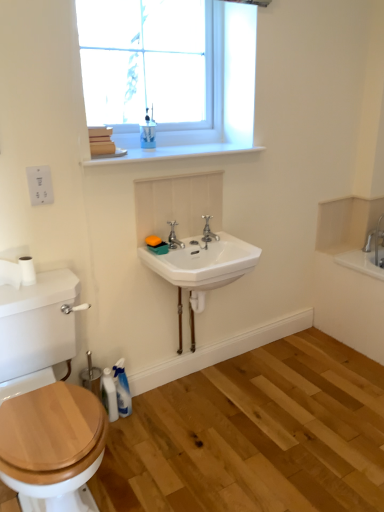
Question: Considering the relative sizes of blue glossy cup at upper center, acting as the 1th toiletry starting from the top, and white matte toilet paper at left in the image provided, is blue glossy cup at upper center, acting as the 1th toiletry starting from the top, smaller than white matte toilet paper at left?

Choices:
 (A) yes
 (B) no

Answer: (B)

Question: Does blue glossy cup at upper center, the 1th toiletry viewed from the right, have a greater height compared to white matte toilet paper at left?

Choices:
 (A) no
 (B) yes

Answer: (B)

Question: From a real-world perspective, is blue glossy cup at upper center, the 1th toiletry viewed from the right, positioned over white matte toilet paper at left based on gravity?

Choices:
 (A) no
 (B) yes

Answer: (B)

Question: Can you confirm if blue glossy cup at upper center, positioned as the second toiletry in bottom-to-top order, is shorter than white matte toilet paper at left?

Choices:
 (A) yes
 (B) no

Answer: (B)

Question: Is the depth of blue glossy cup at upper center, acting as the 1th toiletry starting from the top, greater than that of white matte toilet paper at left?

Choices:
 (A) no
 (B) yes

Answer: (B)

Question: Can you confirm if blue glossy cup at upper center, positioned as the second toiletry in bottom-to-top order, is positioned to the right of white matte toilet paper at left?

Choices:
 (A) yes
 (B) no

Answer: (A)

Question: Can you confirm if translucent plastic spray bottle at lower left, arranged as the first toiletry when viewed from the left, is shorter than white glossy bottle at lower left?

Choices:
 (A) yes
 (B) no

Answer: (B)

Question: Is there a large distance between translucent plastic spray bottle at lower left, the 2th toiletry viewed from the top, and white glossy bottle at lower left?

Choices:
 (A) yes
 (B) no

Answer: (B)

Question: Is the depth of translucent plastic spray bottle at lower left, arranged as the first toiletry when viewed from the left, greater than that of white glossy bottle at lower left?

Choices:
 (A) no
 (B) yes

Answer: (B)

Question: Is translucent plastic spray bottle at lower left, arranged as the first toiletry when viewed from the left, next to white glossy bottle at lower left and touching it?

Choices:
 (A) yes
 (B) no

Answer: (A)

Question: From a real-world perspective, is translucent plastic spray bottle at lower left, the 2th toiletry viewed from the top, beneath white glossy bottle at lower left?

Choices:
 (A) yes
 (B) no

Answer: (B)

Question: Would you say translucent plastic spray bottle at lower left, the 1th toiletry in the bottom-to-top sequence, contains white glossy bottle at lower left?

Choices:
 (A) no
 (B) yes

Answer: (A)

Question: Is white ceramic sink at center wider than polished chrome faucet at center, marked as the 1th tap in a right-to-left arrangement?

Choices:
 (A) no
 (B) yes

Answer: (B)